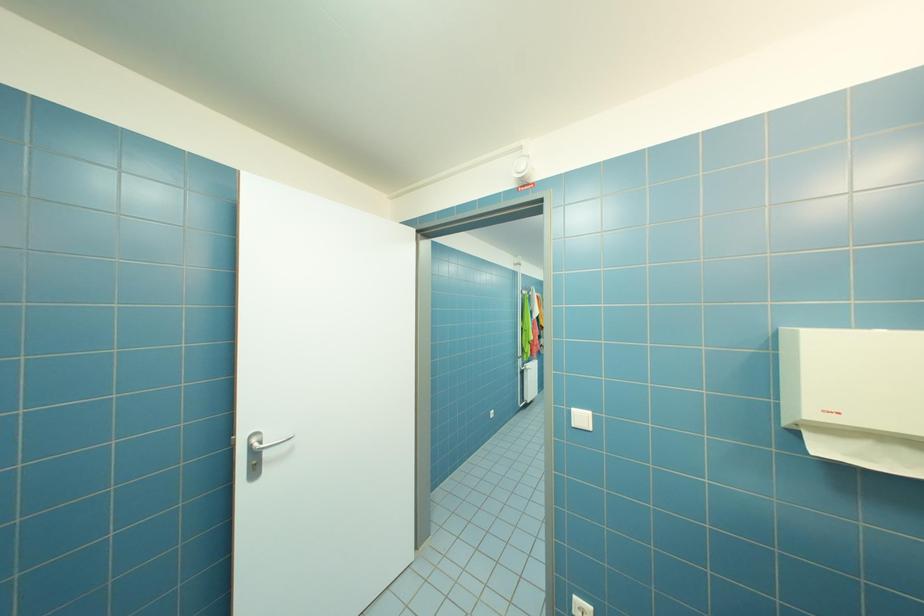
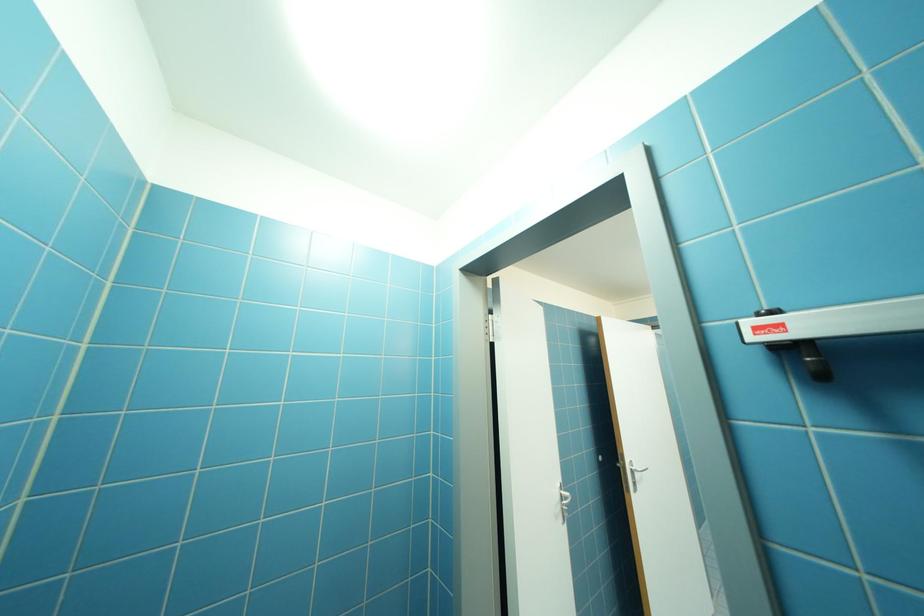
Which direction would the cameraman need to move to produce the second image?

The movement direction of the cameraman is left, backward.